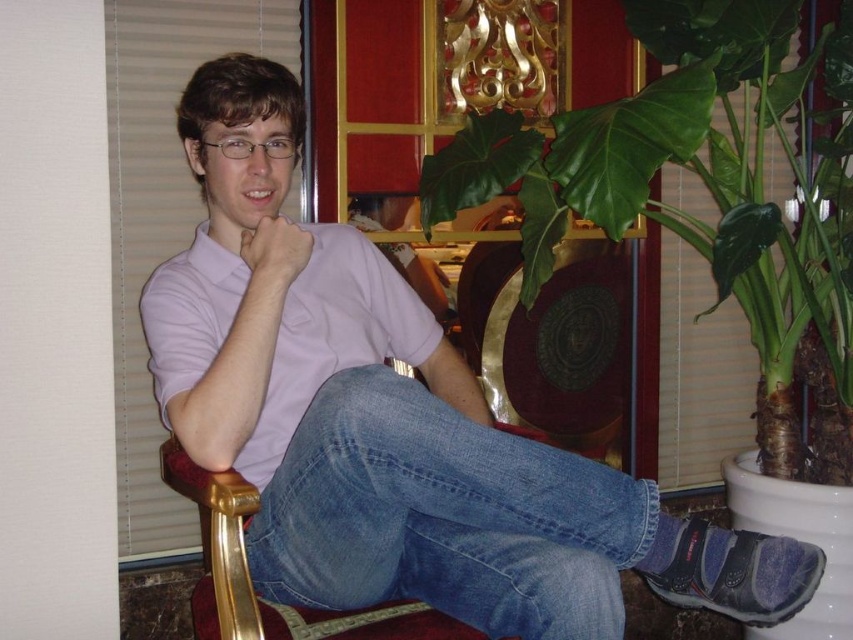
Who is lower down, light purple cotton shirt at center or matte skin hand at center?

light purple cotton shirt at center is lower down.

Does point (186, 275) come farther from viewer compared to point (273, 278)?

Yes, it is behind point (273, 278).

Locate an element on the screen. light purple cotton shirt at center is located at coordinates (332, 336).

Who is more forward, (605, 627) or (267, 266)?

Point (605, 627)

Image resolution: width=853 pixels, height=640 pixels. What are the coordinates of `denim jeans at center` in the screenshot? It's located at (x=444, y=516).

Who is higher up, light purple shirt at center or green leafy plant at right?

green leafy plant at right is above.

Does light purple shirt at center appear over green leafy plant at right?

Incorrect, light purple shirt at center is not positioned above green leafy plant at right.

Locate an element on the screen. The height and width of the screenshot is (640, 853). light purple shirt at center is located at coordinates (397, 426).